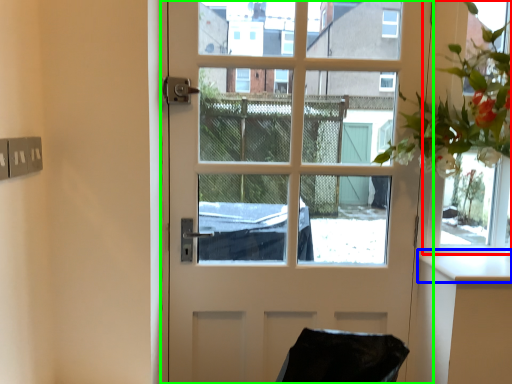
Question: Which is nearer to the window frame (highlighted by a red box)? counter top (highlighted by a blue box) or door (highlighted by a green box).

Choices:
 (A) counter top
 (B) door

Answer: (A)